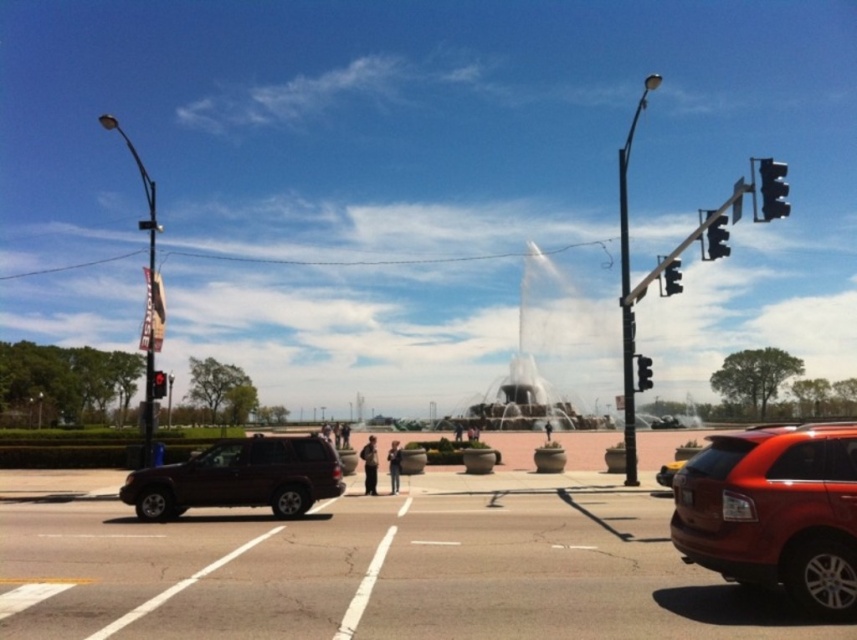
You are a person standing at the intersection and want to cross the street. You see a dark gray fabric jacket at center and dark blue jeans at center. Which clothing item is wider?

The dark gray fabric jacket at center might be wider than dark blue jeans at center.